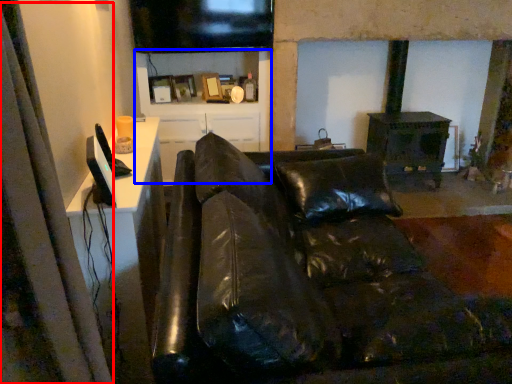
Question: Among these objects, which one is farthest to the camera, curtain (highlighted by a red box) or tv cabinet (highlighted by a blue box)?

Choices:
 (A) curtain
 (B) tv cabinet

Answer: (B)